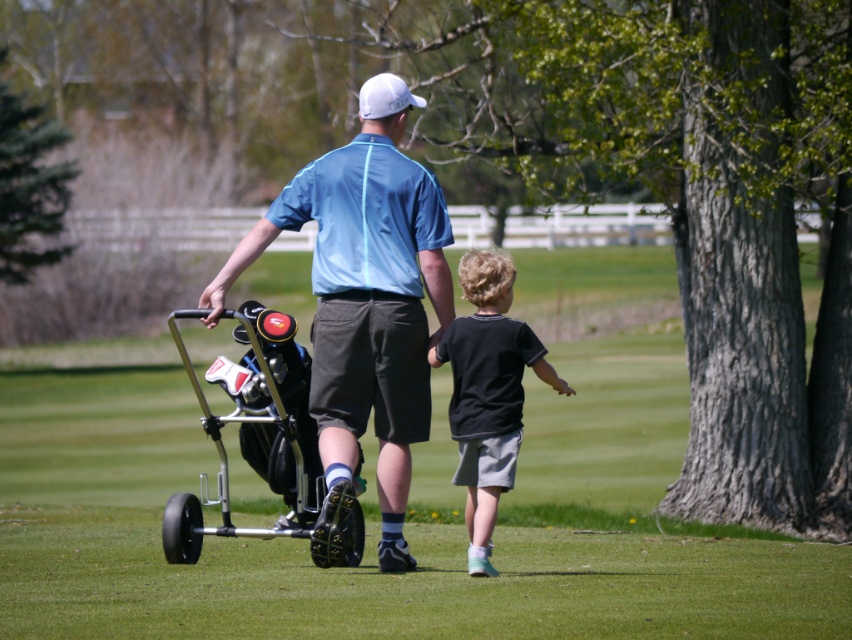
Does metallic silver golf cart at center have a greater height compared to black cotton shirt at center?

Incorrect, metallic silver golf cart at center's height is not larger of black cotton shirt at center's.

Between metallic silver golf cart at center and black cotton shirt at center, which one is positioned lower?

black cotton shirt at center

Is point (286, 458) less distant than point (504, 257)?

No, it is not.

Identify the location of metallic silver golf cart at center. (263, 413).

Consider the image. Which is above, matte blue shirt at center or metallic silver golf cart at center?

Positioned higher is matte blue shirt at center.

Is matte blue shirt at center to the left of metallic silver golf cart at center from the viewer's perspective?

In fact, matte blue shirt at center is to the right of metallic silver golf cart at center.

In order to click on matte blue shirt at center in this screenshot , I will do tap(364, 308).

Who is positioned more to the right, green grass at center or matte blue shirt at center?

From the viewer's perspective, matte blue shirt at center appears more on the right side.

Who is more forward, (554, 426) or (311, 376)?

Point (311, 376)

Locate an element on the screen. The height and width of the screenshot is (640, 852). green grass at center is located at coordinates (404, 524).